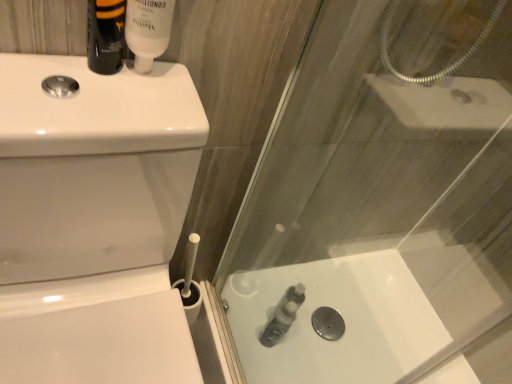
The height and width of the screenshot is (384, 512). Identify the location of vacant area to the left of translucent plastic bottle at lower center, positioned as the first toiletry in right-to-left order. (242, 318).